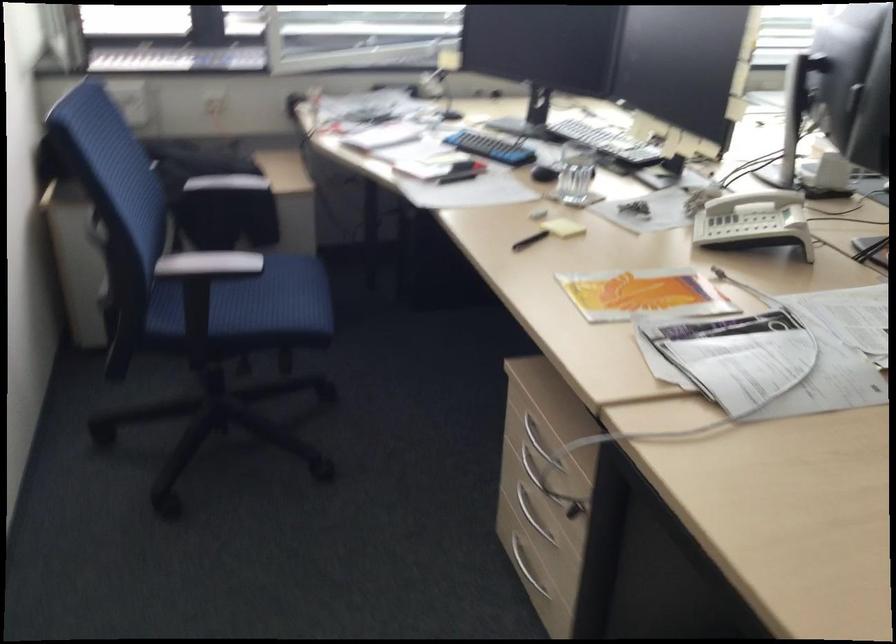
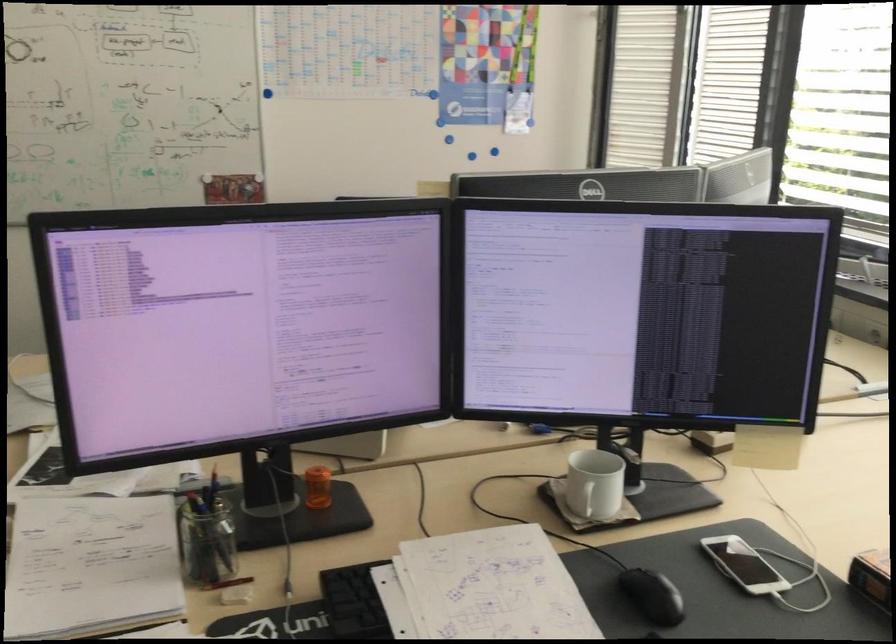
Question: I am providing you with two images of the same scene from different viewpoints. After the viewpoint changes to image2, which objects are now occluded?

Choices:
 (A) glass pencil holder
 (B) brown folded blanket
 (C) blue push pin
 (D) white chair armrest

Answer: (D)